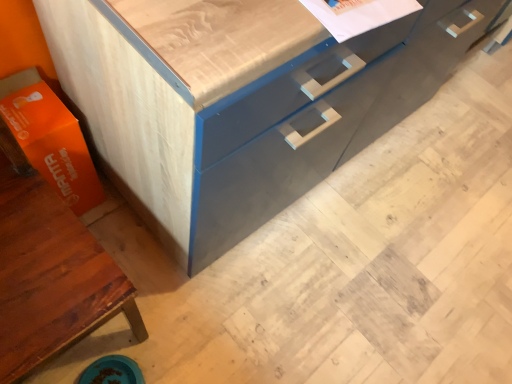
In order to click on vacant region above orange matte cardboard box at lower left (from a real-world perspective) in this screenshot , I will do `click(28, 107)`.